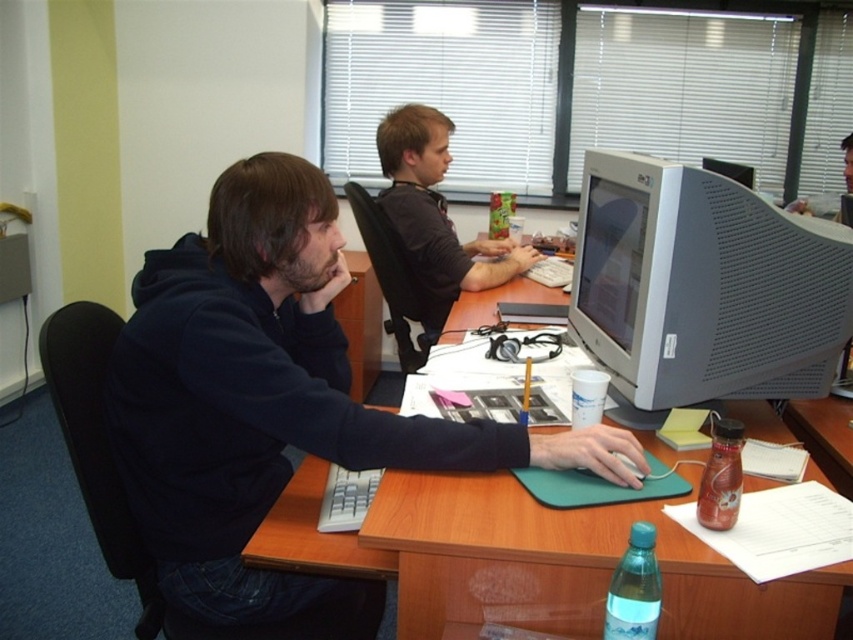
Question: Does dark blue hoodie at center have a lesser width compared to gray plastic monitor at right?

Choices:
 (A) yes
 (B) no

Answer: (B)

Question: Is gray plastic monitor at right wider than matte black shirt at center?

Choices:
 (A) yes
 (B) no

Answer: (B)

Question: Which object is closer to the camera taking this photo?

Choices:
 (A) gray plastic monitor at right
 (B) green plastic mousepad at center
 (C) dark blue hoodie at center

Answer: (B)

Question: Is dark blue hoodie at center above gray plastic monitor at right?

Choices:
 (A) yes
 (B) no

Answer: (B)

Question: Among these points, which one is nearest to the camera?

Choices:
 (A) (611, 308)
 (B) (721, 586)
 (C) (469, 260)
 (D) (109, 385)

Answer: (B)

Question: Among these objects, which one is farthest from the camera?

Choices:
 (A) dark blue hoodie at center
 (B) gray plastic monitor at right
 (C) matte black shirt at center

Answer: (C)